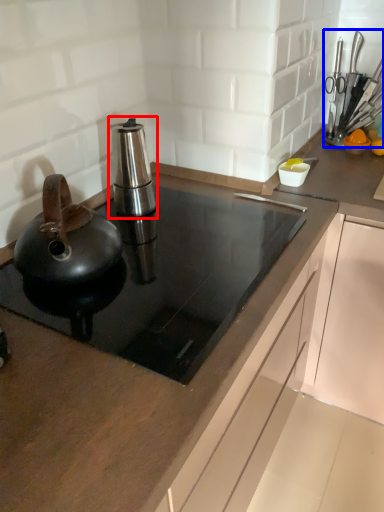
Question: Which point is further to the camera, kitchen appliance (highlighted by a red box) or appliance (highlighted by a blue box)?

Choices:
 (A) kitchen appliance
 (B) appliance

Answer: (B)